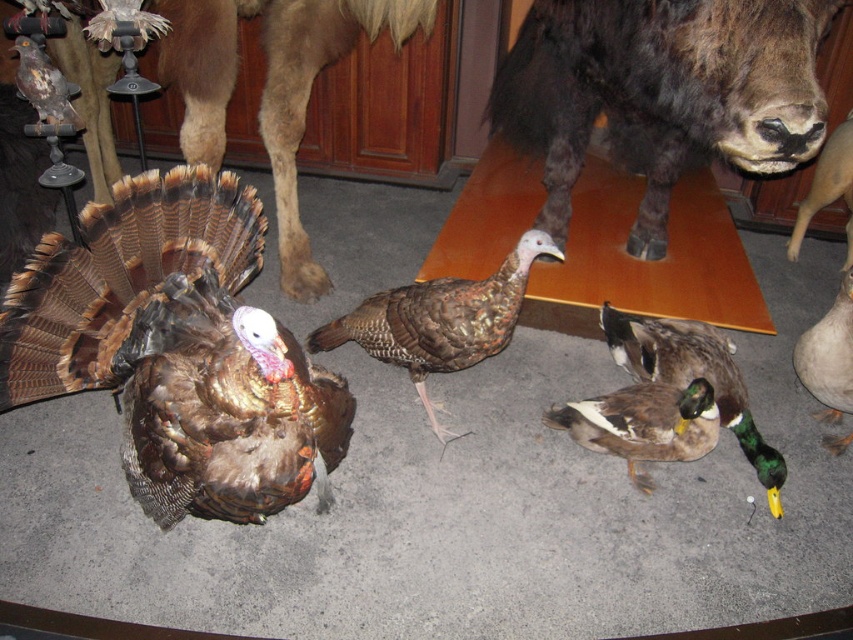
You are a museum visitor standing in front of the shiny brown turkey at center. If you want to touch the turkey, will you be able to reach it without moving your body?

The shiny brown turkey at center is 1.35 meters away from the viewer, so you cannot reach it without moving your body since the average human arm length is about 0.7 meters.

You are a museum guide explaining the exhibit to visitors. You need to mention the height difference between the shiny brown turkey at center and the dark brown fur at upper right. How would you describe their sizes in relation to each other?

The shiny brown turkey at center is shorter than the dark brown fur at upper right.